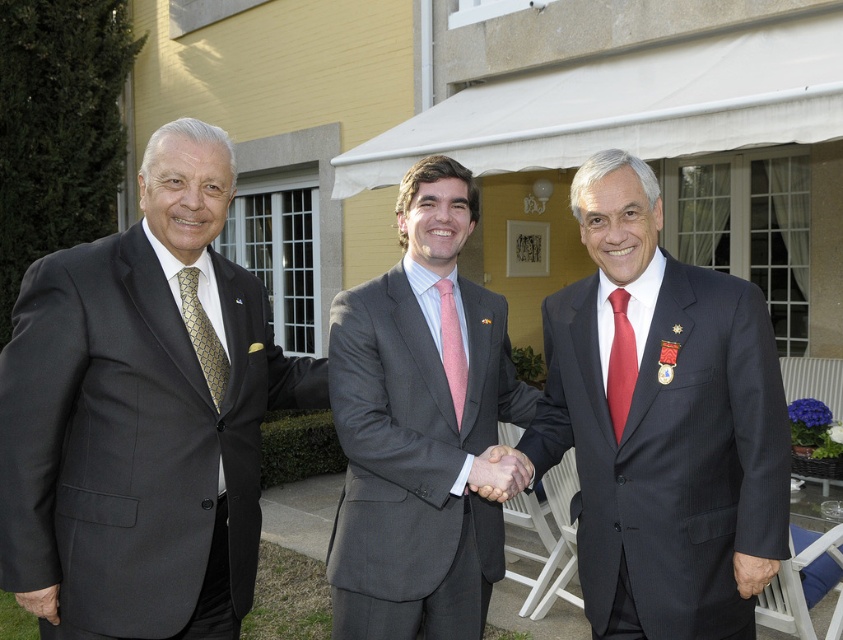
Between matte gray suit at center and matte black hand at center, which one has more height?

Standing taller between the two is matte gray suit at center.

Which is more to the right, matte gray suit at center or matte black hand at center?

matte black hand at center

Locate an element on the screen. Image resolution: width=843 pixels, height=640 pixels. matte gray suit at center is located at coordinates (419, 426).

The image size is (843, 640). Find the location of `matte gray suit at center`. matte gray suit at center is located at coordinates (419, 426).

Is point (450, 305) positioned after point (738, 561)?

Yes, it is behind point (738, 561).

Is pink textured tie at center above smooth skin hand at center?

Yes, pink textured tie at center is above smooth skin hand at center.

Is point (450, 291) less distant than point (756, 566)?

No.

Identify the location of pink textured tie at center. (452, 348).

Can you confirm if matte black suit at left is bigger than matte black hand at center?

Correct, matte black suit at left is larger in size than matte black hand at center.

Does matte black suit at left have a greater height compared to matte black hand at center?

Yes.

The image size is (843, 640). I want to click on matte black suit at left, so coord(140,417).

Where is `matte black suit at left`? This screenshot has width=843, height=640. matte black suit at left is located at coordinates (140, 417).